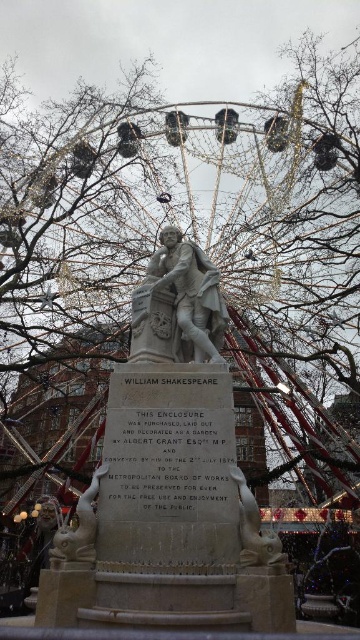
Is point (209, 272) positioned before point (254, 540)?

No.

Looking at this image, is white marble statue at center in front of white stone lion at lower center?

That is False.

Who is more forward, [186,257] or [240,476]?

Point [240,476] is in front.

This screenshot has width=360, height=640. I want to click on white marble statue at center, so (186, 296).

Which is more to the left, white marble lion at lower left or white stone lion at lower center?

white marble lion at lower left

Is white marble lion at lower left closer to the viewer compared to white stone lion at lower center?

No, it is behind white stone lion at lower center.

Is point (69, 545) farther from viewer compared to point (279, 550)?

Yes, it is.

Identify the location of white marble lion at lower left. click(x=78, y=529).

Is bare branches at center to the left of white stone lion at lower center from the viewer's perspective?

Indeed, bare branches at center is positioned on the left side of white stone lion at lower center.

Where is `bare branches at center`? The image size is (360, 640). bare branches at center is located at coordinates (69, 216).

Find the location of `bare branches at center`. bare branches at center is located at coordinates (69, 216).